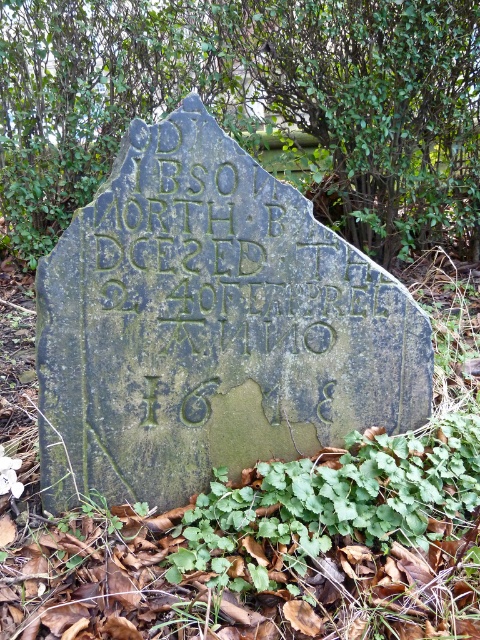
You are a gardener who wants to place a new small statue between the green mossy stone gravestone at center and the green leafy plant at lower center. Since the statue is 1.2 meters tall, will it be taller than both objects?

The green mossy stone gravestone at center has a greater height compared to green leafy plant at lower center. Since the gravestone is taller than the plant, and the statue is 1.2 meters tall, we need to compare the statue height with the gravestone. However, the exact height of the gravestone is not provided, so we cannot determine if the statue will be taller than both objects.

Based on the scene described, which object is smaller in size between the green mossy stone gravestone at center and the green leafy tree at upper center?

The green mossy stone gravestone at center is smaller in size compared to the green leafy tree at upper center.